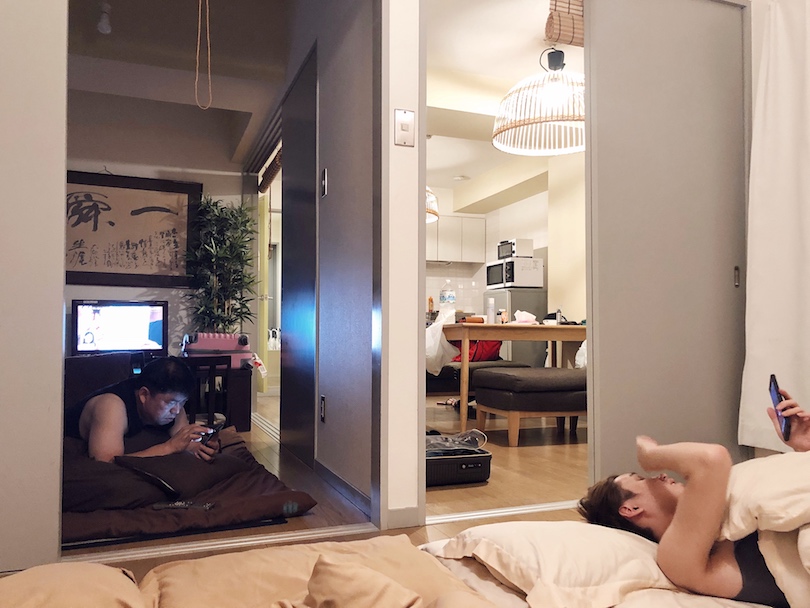
The height and width of the screenshot is (608, 810). In order to click on phones in this screenshot , I will do `click(772, 391)`, `click(216, 430)`.